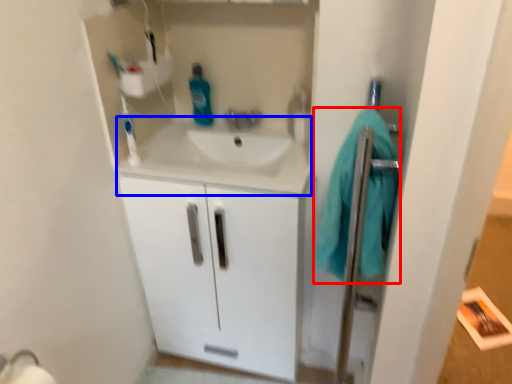
Question: Which object appears farthest to the camera in this image, bath towel (highlighted by a red box) or counter top (highlighted by a blue box)?

Choices:
 (A) bath towel
 (B) counter top

Answer: (B)